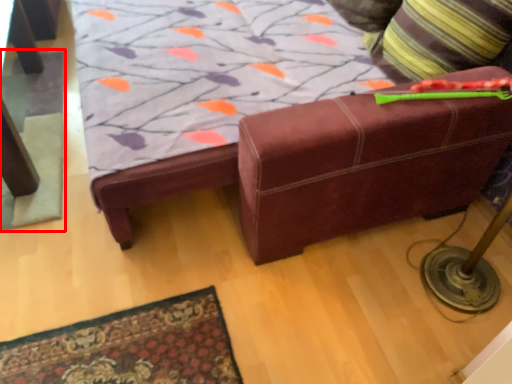
Question: From the image, what is the correct spatial relationship of mat (annotated by the red box) in relation to throw pillow?

Choices:
 (A) right
 (B) left

Answer: (B)